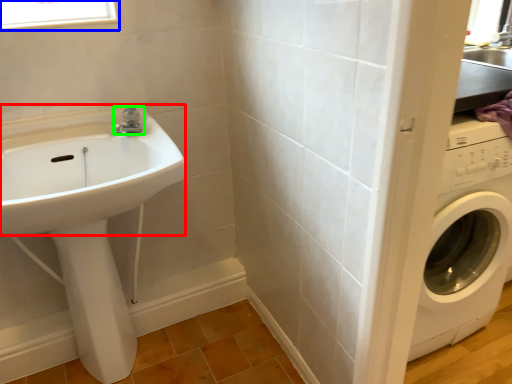
Question: Considering the real-world distances, which object is farthest from sink (highlighted by a red box)? window (highlighted by a blue box) or tap (highlighted by a green box)?

Choices:
 (A) window
 (B) tap

Answer: (A)